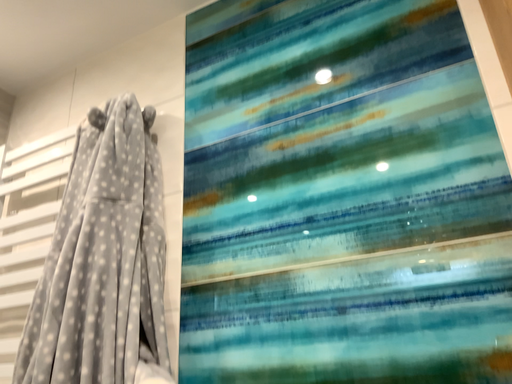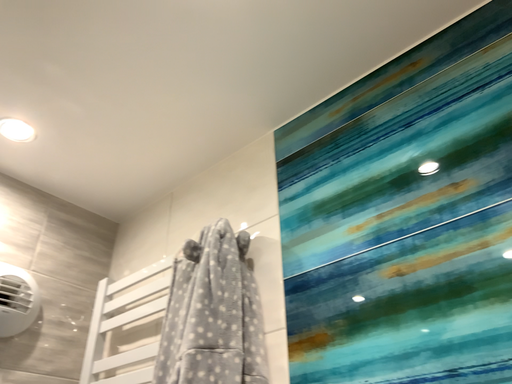
Question: How did the camera likely rotate when shooting the video?

Choices:
 (A) rotated upward
 (B) rotated downward

Answer: (A)